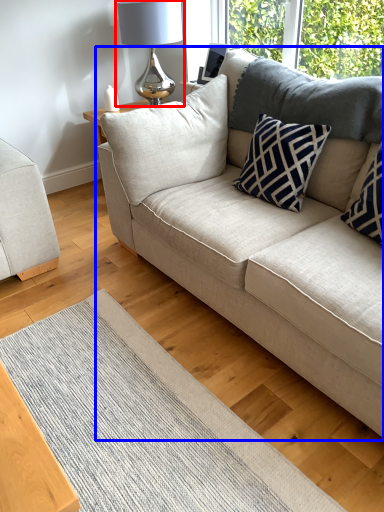
Question: Which of the following is the closest to the observer, table lamp (highlighted by a red box) or studio couch (highlighted by a blue box)?

Choices:
 (A) table lamp
 (B) studio couch

Answer: (B)